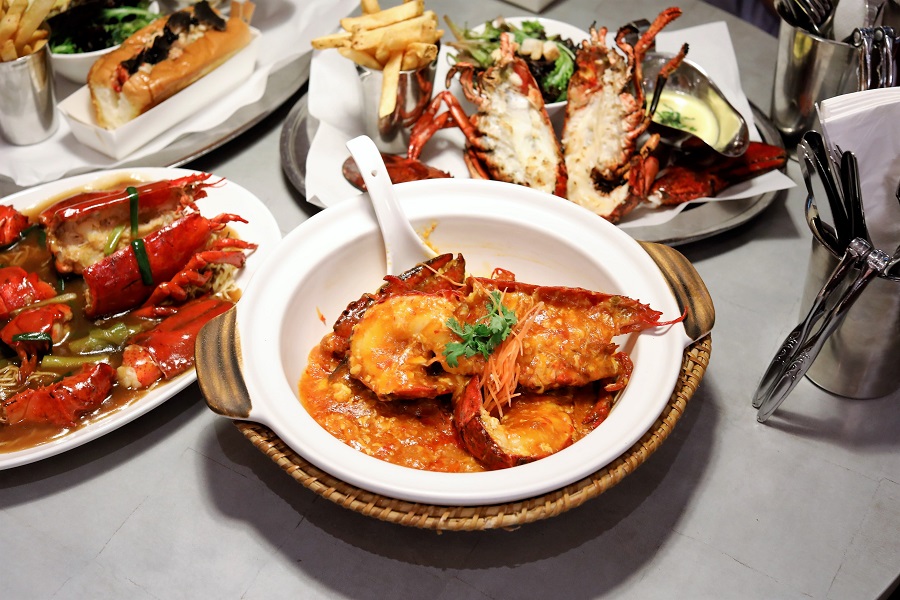
The height and width of the screenshot is (600, 900). Identify the location of utensils. (825, 191), (817, 14), (883, 62).